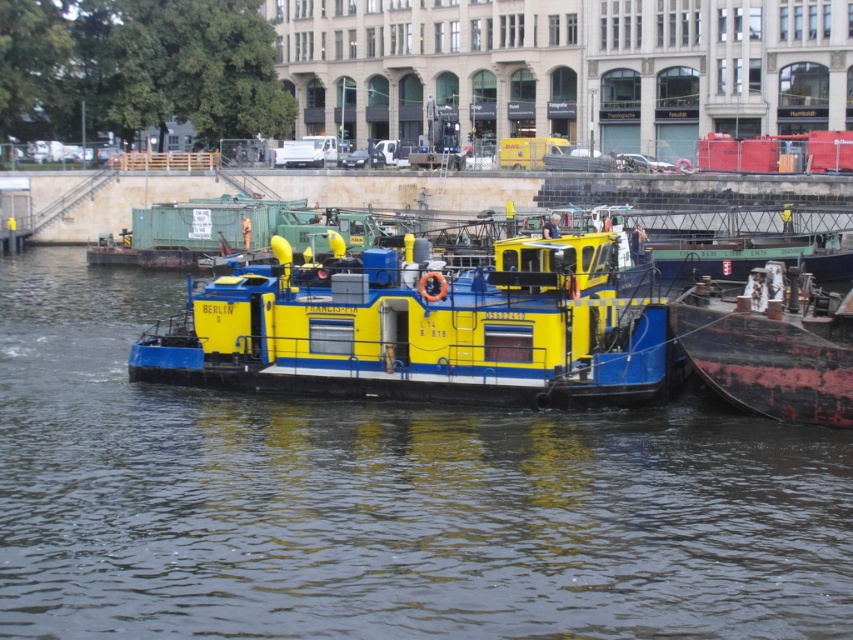
Which is below, blue/yellow barge at center or yellow matte barge at center?

blue/yellow barge at center is below.

Can you confirm if blue/yellow barge at center is wider than yellow matte barge at center?

Indeed, blue/yellow barge at center has a greater width compared to yellow matte barge at center.

Is point (1, 525) farther from viewer compared to point (312, 323)?

No.

I want to click on blue/yellow barge at center, so click(x=383, y=500).

Who is taller, blue/yellow barge at center or rusty metal barge at right?

blue/yellow barge at center is taller.

Can you confirm if blue/yellow barge at center is positioned to the right of rusty metal barge at right?

No, blue/yellow barge at center is not to the right of rusty metal barge at right.

The image size is (853, 640). I want to click on blue/yellow barge at center, so click(x=383, y=500).

The width and height of the screenshot is (853, 640). I want to click on blue/yellow barge at center, so click(383, 500).

Does yellow matte barge at center appear on the right side of rusty metal barge at right?

In fact, yellow matte barge at center is to the left of rusty metal barge at right.

Is yellow matte barge at center wider than rusty metal barge at right?

Indeed, yellow matte barge at center has a greater width compared to rusty metal barge at right.

The image size is (853, 640). Describe the element at coordinates (421, 326) in the screenshot. I see `yellow matte barge at center` at that location.

I want to click on yellow matte barge at center, so click(x=421, y=326).